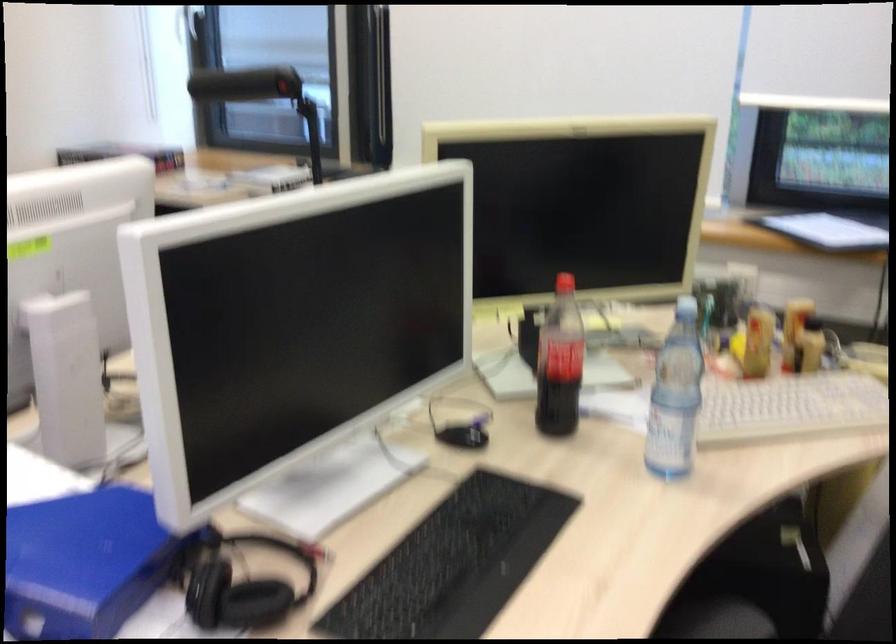
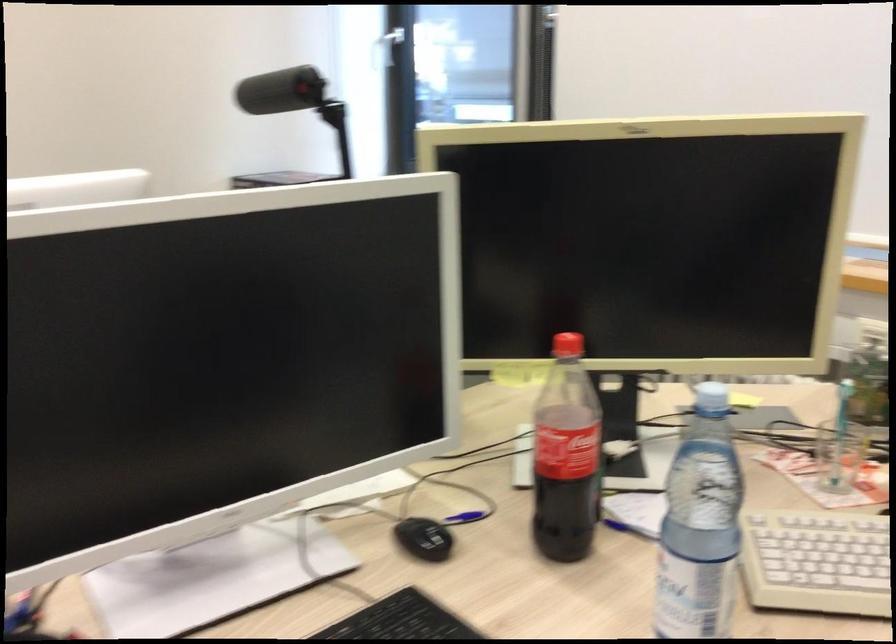
Question: The images are taken continuously from a first-person perspective. In which direction is your viewpoint rotating?

Choices:
 (A) Left
 (B) Right
 (C) Up
 (D) Down

Answer: (A)